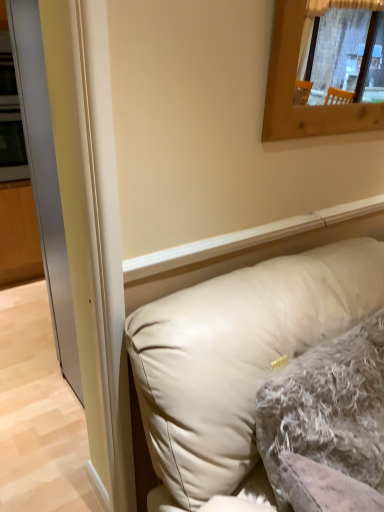
Question: Is transparent glass door at left inside beige leather pillow at lower right, positioned as the 1th pillow in front-to-back order?

Choices:
 (A) no
 (B) yes

Answer: (A)

Question: Considering the relative sizes of beige leather pillow at lower right, positioned as the 1th pillow in front-to-back order, and transparent glass door at left in the image provided, is beige leather pillow at lower right, positioned as the 1th pillow in front-to-back order, taller than transparent glass door at left?

Choices:
 (A) no
 (B) yes

Answer: (A)

Question: Is beige leather pillow at lower right, the second pillow in the back-to-front sequence, bigger than transparent glass door at left?

Choices:
 (A) yes
 (B) no

Answer: (A)

Question: From the image's perspective, is beige leather pillow at lower right, positioned as the 1th pillow in front-to-back order, beneath transparent glass door at left?

Choices:
 (A) yes
 (B) no

Answer: (A)

Question: Is beige leather pillow at lower right, positioned as the 1th pillow in front-to-back order, to the right of transparent glass door at left from the viewer's perspective?

Choices:
 (A) yes
 (B) no

Answer: (A)

Question: Considering the positions of fuzzy gray pillow at center, the 2th pillow positioned from the front, and beige leather pillow at lower right, the second pillow in the back-to-front sequence, in the image, is fuzzy gray pillow at center, the 2th pillow positioned from the front, bigger or smaller than beige leather pillow at lower right, the second pillow in the back-to-front sequence,?

Choices:
 (A) big
 (B) small

Answer: (B)

Question: Considering the relative positions of fuzzy gray pillow at center, the 2th pillow positioned from the front, and beige leather pillow at lower right, the second pillow in the back-to-front sequence, in the image provided, is fuzzy gray pillow at center, the 2th pillow positioned from the front, to the left or to the right of beige leather pillow at lower right, the second pillow in the back-to-front sequence,?

Choices:
 (A) right
 (B) left

Answer: (A)

Question: From their relative heights in the image, would you say fuzzy gray pillow at center, the 2th pillow positioned from the front, is taller or shorter than beige leather pillow at lower right, positioned as the 1th pillow in front-to-back order?

Choices:
 (A) short
 (B) tall

Answer: (A)

Question: In the image, is fuzzy gray pillow at center, the first pillow in the back-to-front sequence, positioned in front of or behind beige leather pillow at lower right, positioned as the 1th pillow in front-to-back order?

Choices:
 (A) behind
 (B) front

Answer: (A)

Question: Is fuzzy gray pillow at center, the first pillow in the back-to-front sequence, bigger or smaller than transparent glass door at left?

Choices:
 (A) big
 (B) small

Answer: (A)

Question: Is fuzzy gray pillow at center, the first pillow in the back-to-front sequence, to the left or to the right of transparent glass door at left in the image?

Choices:
 (A) left
 (B) right

Answer: (B)

Question: Which is correct: fuzzy gray pillow at center, the first pillow in the back-to-front sequence, is inside transparent glass door at left, or outside of it?

Choices:
 (A) outside
 (B) inside

Answer: (A)

Question: Does point (360, 369) appear closer or farther from the camera than point (24, 82)?

Choices:
 (A) closer
 (B) farther

Answer: (A)

Question: In the image, is beige leather pillow at lower right, the second pillow in the back-to-front sequence, on the left side or the right side of transparent glass door at left?

Choices:
 (A) left
 (B) right

Answer: (B)

Question: Is beige leather pillow at lower right, the second pillow in the back-to-front sequence, in front of or behind transparent glass door at left in the image?

Choices:
 (A) behind
 (B) front

Answer: (B)